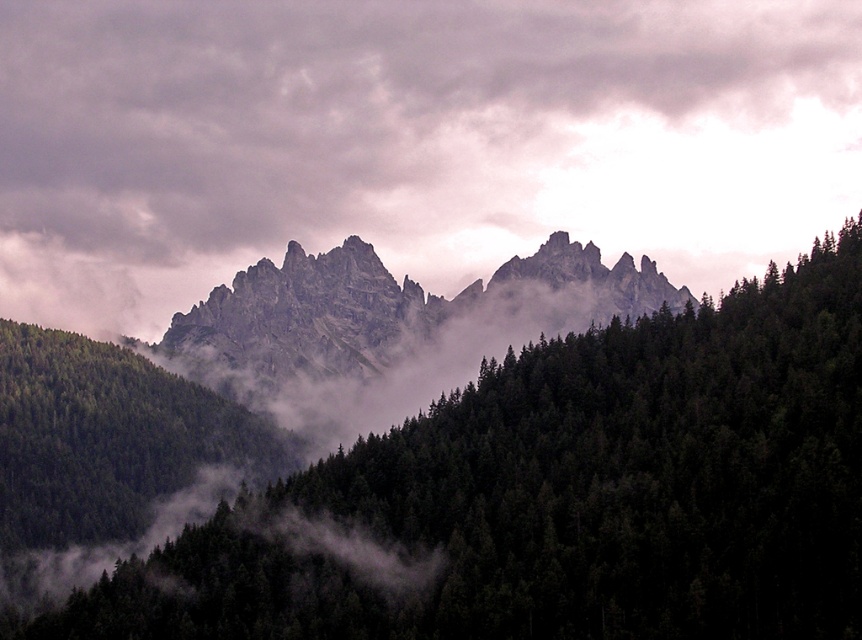
Question: Can you confirm if dark green textured trees at center is wider than rugged stone mountain at center?

Choices:
 (A) yes
 (B) no

Answer: (B)

Question: Which point is farther to the camera?

Choices:
 (A) gray cloudy sky at upper center
 (B) rugged stone mountain at center

Answer: (A)

Question: Can you confirm if gray cloudy sky at upper center is positioned above rugged stone mountain at center?

Choices:
 (A) yes
 (B) no

Answer: (A)

Question: Among these objects, which one is nearest to the camera?

Choices:
 (A) gray cloudy sky at upper center
 (B) dark green textured trees at center

Answer: (B)

Question: Observing the image, what is the correct spatial positioning of dark green textured trees at center in reference to rugged stone mountain at center?

Choices:
 (A) above
 (B) below

Answer: (B)

Question: Among these points, which one is farthest from the camera?

Choices:
 (A) (267, 326)
 (B) (177, 595)

Answer: (A)